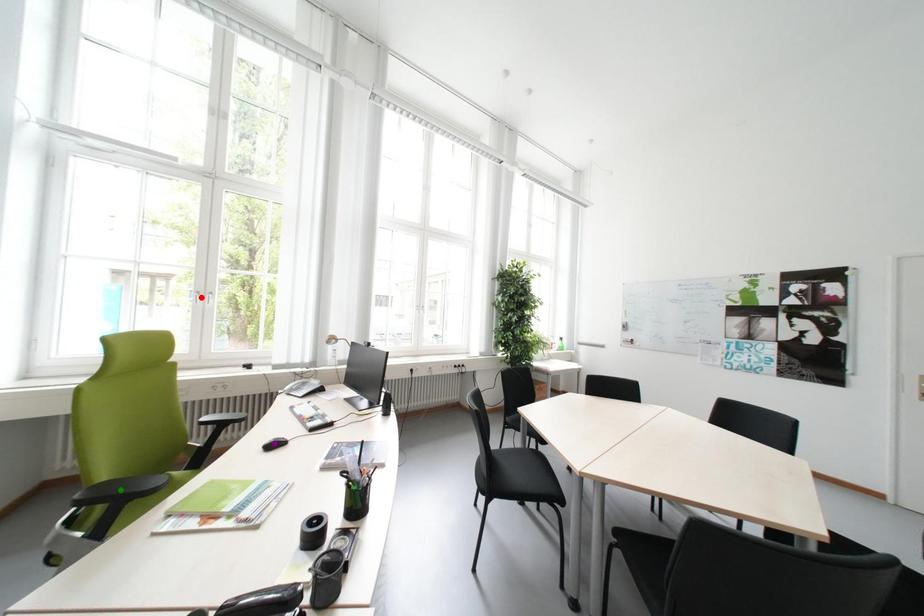
Order these from nearest to farthest:
red point, purple point, green point

1. green point
2. purple point
3. red point